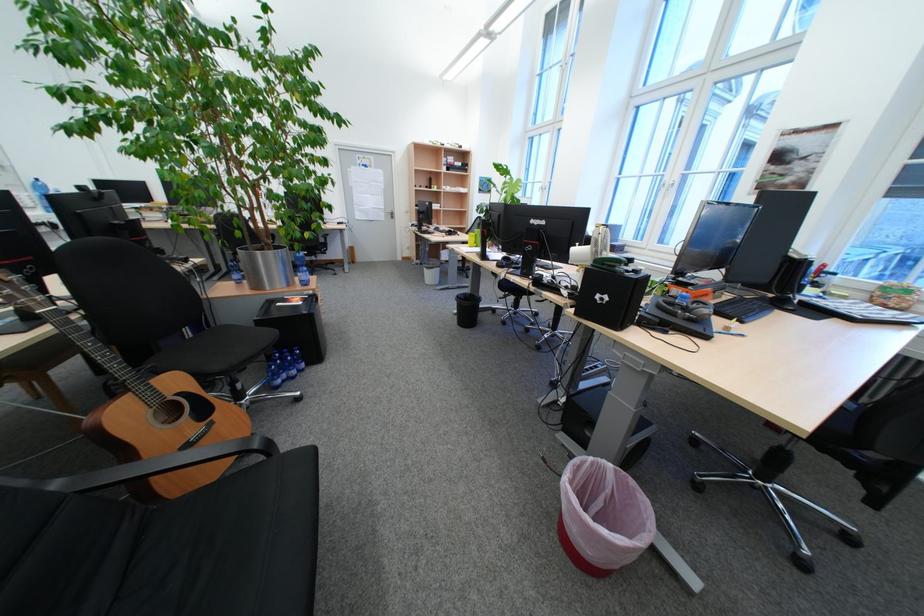
Find where to pull the silver door handle. Please return your answer as a coordinate pair (x, y).

(391, 214)